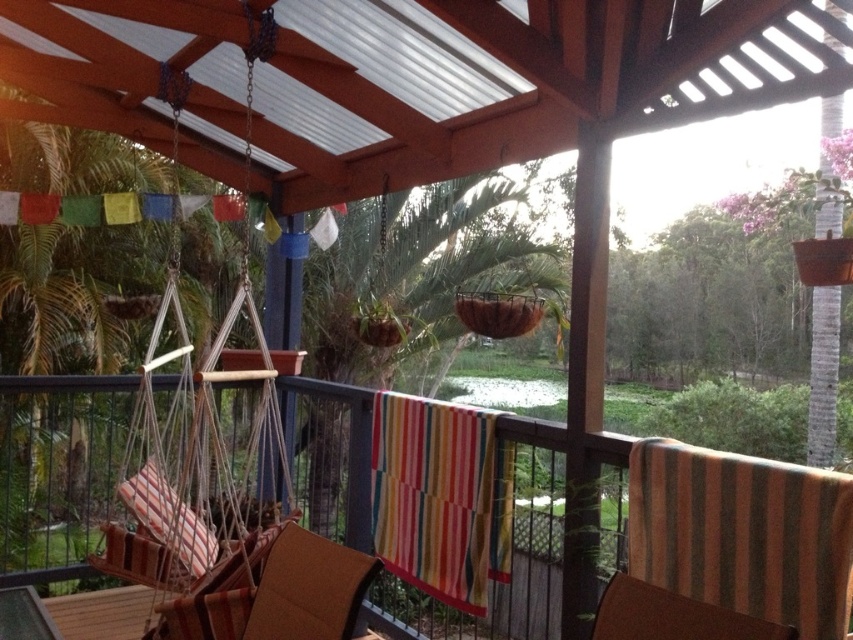
You are planning to hang a new swing on the patio. The existing swing is located at point (201, 458). Can you confirm if there is space to hang another swing on the right side of the existing one?

The existing swing at point (201, 458) is located at the left side, so there is space on the right side to hang another swing.

You are planning to place a 6 feet long table between the striped fabric swing at left and the brown striped fabric chair at center. Can the table fit in the space between them?

The striped fabric swing at left is 5.86 feet away from the brown striped fabric chair at center. Since the table is 6 feet long, it would not fit in the space between them as the distance is slightly shorter than the table length.